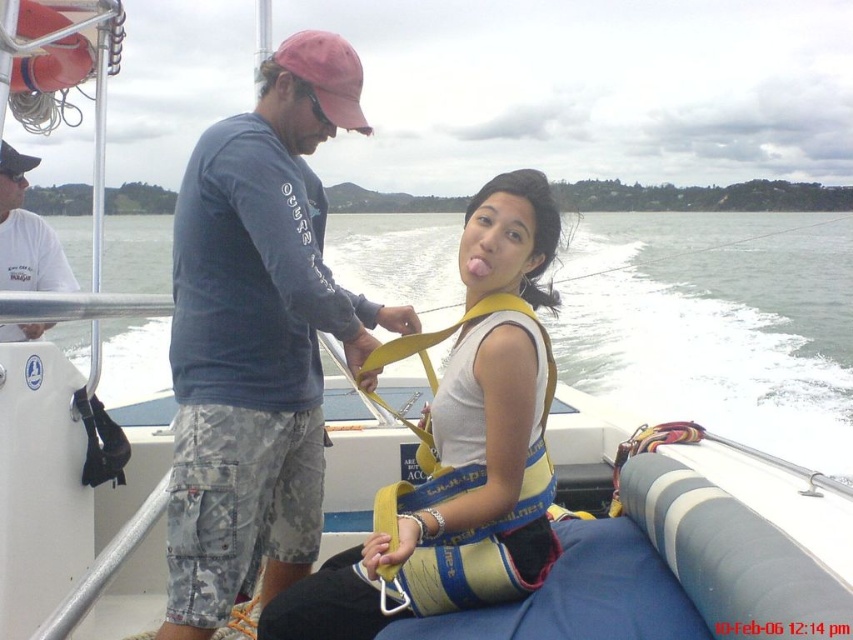
Does yellow fabric life vest at center appear under white cotton shirt at upper left?

Yes.

At what (x,y) coordinates should I click in order to perform the action: click on yellow fabric life vest at center. Please return your answer as a coordinate pair (x, y). The width and height of the screenshot is (853, 640). Looking at the image, I should click on (460, 448).

Which is behind, point (486, 284) or point (25, 326)?

The point (25, 326) is more distant.

Locate an element on the screen. The width and height of the screenshot is (853, 640). yellow fabric life vest at center is located at coordinates (460, 448).

Which of these two, camouflage shorts at center or yellow fabric life vest at center, stands shorter?

yellow fabric life vest at center

Can you confirm if camouflage shorts at center is shorter than yellow fabric life vest at center?

No.

Does point (271, 564) lie in front of point (457, 588)?

No, it is not.

This screenshot has height=640, width=853. What are the coordinates of `camouflage shorts at center` in the screenshot? It's located at (257, 337).

Image resolution: width=853 pixels, height=640 pixels. Find the location of `camouflage shorts at center`. camouflage shorts at center is located at coordinates (257, 337).

Does point (260, 486) come behind point (25, 243)?

No, it is not.

Is point (257, 148) closer to camera compared to point (19, 164)?

That is True.

Identify the location of camouflage shorts at center. The image size is (853, 640). (257, 337).